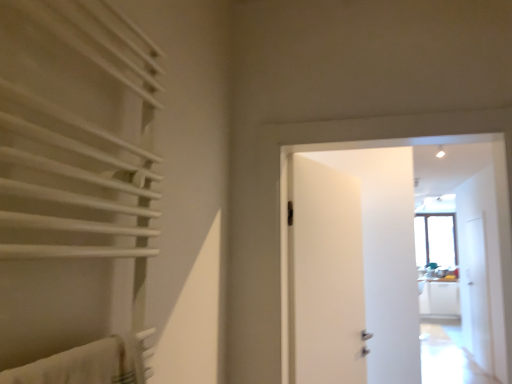
Question: Is white matte door at center positioned far away from transparent glass screen door at right?

Choices:
 (A) yes
 (B) no

Answer: (A)

Question: Does white matte door at center have a lesser width compared to transparent glass screen door at right?

Choices:
 (A) no
 (B) yes

Answer: (A)

Question: Is transparent glass screen door at right inside white matte door at center?

Choices:
 (A) no
 (B) yes

Answer: (A)

Question: Is white matte door at center taller than transparent glass screen door at right?

Choices:
 (A) yes
 (B) no

Answer: (B)

Question: Is white matte door at center turned away from transparent glass screen door at right?

Choices:
 (A) yes
 (B) no

Answer: (A)

Question: Based on their positions, is white matte towel rack at left located to the left or right of transparent glass screen door at right?

Choices:
 (A) left
 (B) right

Answer: (A)

Question: From a real-world perspective, is white matte towel rack at left physically located above or below transparent glass screen door at right?

Choices:
 (A) below
 (B) above

Answer: (B)

Question: Is point (59, 77) closer or farther from the camera than point (472, 259)?

Choices:
 (A) closer
 (B) farther

Answer: (A)

Question: From the image's perspective, relative to transparent glass screen door at right, is white matte towel rack at left above or below?

Choices:
 (A) above
 (B) below

Answer: (A)

Question: Is white matte towel rack at left in front of or behind white matte door at center in the image?

Choices:
 (A) behind
 (B) front

Answer: (B)

Question: Considering the relative positions of white matte towel rack at left and white matte door at center in the image provided, is white matte towel rack at left to the left or to the right of white matte door at center?

Choices:
 (A) right
 (B) left

Answer: (B)

Question: Is white matte towel rack at left taller or shorter than white matte door at center?

Choices:
 (A) short
 (B) tall

Answer: (A)

Question: From a real-world perspective, is white matte towel rack at left physically located above or below white matte door at center?

Choices:
 (A) above
 (B) below

Answer: (A)

Question: From the image's perspective, is white matte door at center located above or below white matte towel rack at left?

Choices:
 (A) below
 (B) above

Answer: (A)

Question: Would you say white matte door at center is to the left or to the right of white matte towel rack at left in the picture?

Choices:
 (A) left
 (B) right

Answer: (B)